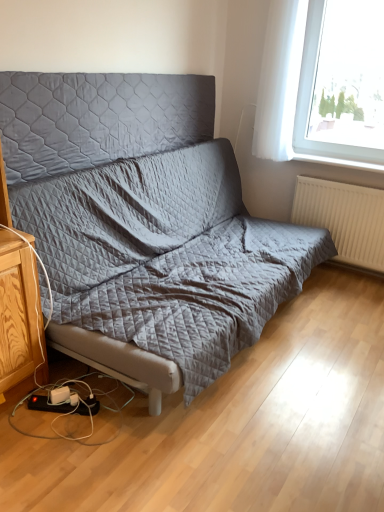
The image size is (384, 512). I want to click on free space to the left of black plastic power strip at lower left, so (x=24, y=416).